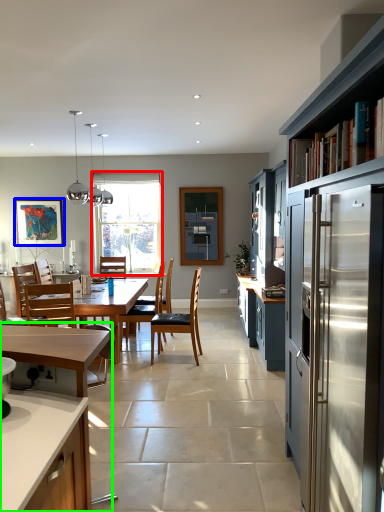
Question: Which object is positioned farthest from window (highlighted by a red box)? Select from picture frame (highlighted by a blue box) and cabinetry (highlighted by a green box).

Choices:
 (A) picture frame
 (B) cabinetry

Answer: (B)